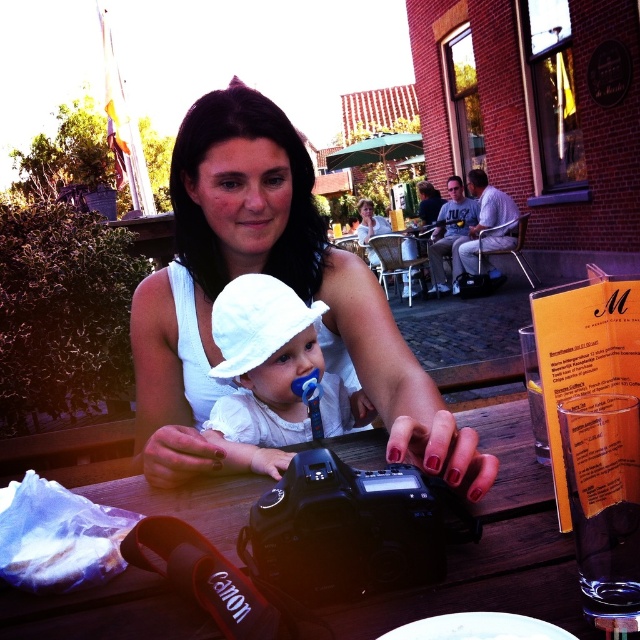
Question: Which point is farther from the camera taking this photo?

Choices:
 (A) (433, 440)
 (B) (264, 445)

Answer: (B)

Question: Is the position of wooden table at center more distant than that of white paper bag at lower left?

Choices:
 (A) yes
 (B) no

Answer: (B)

Question: Is wooden table at center smaller than white paper bag at lower left?

Choices:
 (A) no
 (B) yes

Answer: (A)

Question: Which of the following is the closest to the observer?

Choices:
 (A) [195, 385]
 (B) [124, 525]
 (C) [237, 376]
 (D) [156, 608]

Answer: (D)

Question: Does white matte shirt at center appear on the right side of white paper bag at lower left?

Choices:
 (A) no
 (B) yes

Answer: (B)

Question: Which of the following is the farthest from the observer?

Choices:
 (A) white paper bag at lower left
 (B) white matte shirt at center
 (C) white fabric hat at center
 (D) wooden table at center

Answer: (C)